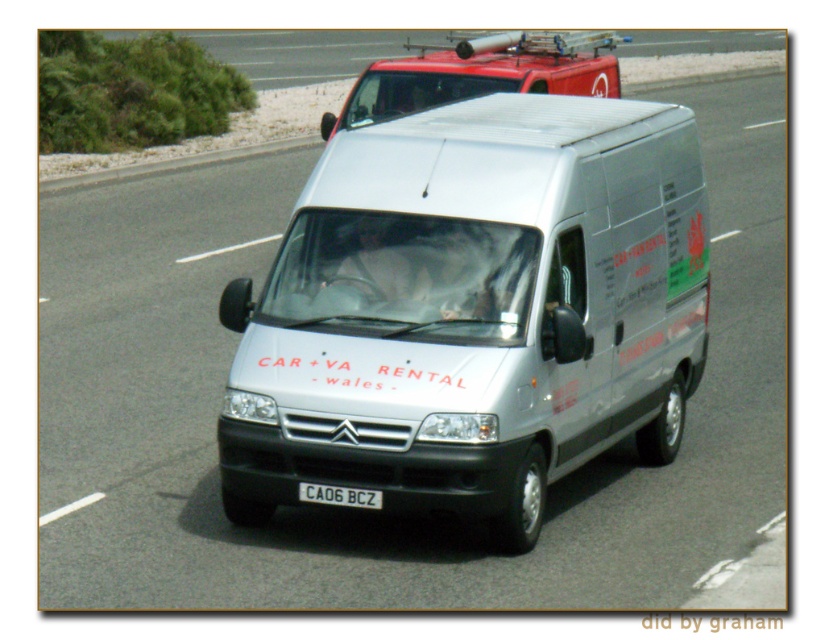
Can you confirm if red matte van at upper center is taller than black plastic license plate at center?

Indeed, red matte van at upper center has a greater height compared to black plastic license plate at center.

Who is more distant from viewer, (x=390, y=60) or (x=373, y=499)?

The point (x=390, y=60) is more distant.

At what (x,y) coordinates should I click in order to perform the action: click on red matte van at upper center. Please return your answer as a coordinate pair (x, y). The width and height of the screenshot is (825, 640). Looking at the image, I should click on (479, 74).

What do you see at coordinates (474, 308) in the screenshot? I see `white matte van at center` at bounding box center [474, 308].

What do you see at coordinates (474, 308) in the screenshot?
I see `white matte van at center` at bounding box center [474, 308].

Identify the location of white matte van at center. This screenshot has height=640, width=825. (474, 308).

Is white matte van at center shorter than red matte van at upper center?

Indeed, white matte van at center has a lesser height compared to red matte van at upper center.

Is the position of white matte van at center less distant than that of red matte van at upper center?

Yes, it is in front of red matte van at upper center.

Is point (647, 179) closer to camera compared to point (573, 67)?

Yes.

What are the coordinates of `white matte van at center` in the screenshot? It's located at (474, 308).